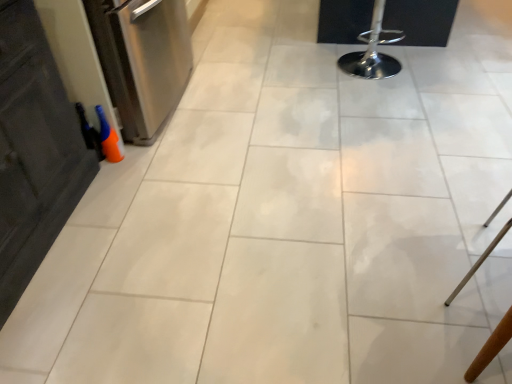
Identify the location of free space between polished chrome bar stool at upper right and wooden chair at lower right. Image resolution: width=512 pixels, height=384 pixels. (421, 153).